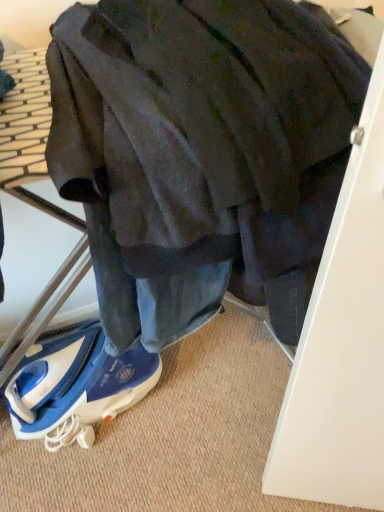
Question: Is blue fabric shoe at lower center positioned beyond the bounds of dark corduroy jacket at center?

Choices:
 (A) yes
 (B) no

Answer: (A)

Question: Is blue fabric shoe at lower center closer to camera compared to dark corduroy jacket at center?

Choices:
 (A) no
 (B) yes

Answer: (A)

Question: Is blue fabric shoe at lower center not close to dark corduroy jacket at center?

Choices:
 (A) no
 (B) yes

Answer: (A)

Question: Is blue fabric shoe at lower center positioned with its back to dark corduroy jacket at center?

Choices:
 (A) yes
 (B) no

Answer: (B)

Question: Is blue fabric shoe at lower center shorter than dark corduroy jacket at center?

Choices:
 (A) no
 (B) yes

Answer: (B)

Question: From the image's perspective, is blue fabric shoe at lower center above dark corduroy jacket at center?

Choices:
 (A) yes
 (B) no

Answer: (B)

Question: Can you confirm if dark corduroy jacket at center is positioned to the left of blue fabric shoe at lower center?

Choices:
 (A) no
 (B) yes

Answer: (A)

Question: Considering the relative sizes of dark corduroy jacket at center and blue fabric shoe at lower center in the image provided, is dark corduroy jacket at center bigger than blue fabric shoe at lower center?

Choices:
 (A) no
 (B) yes

Answer: (B)

Question: Considering the relative sizes of dark corduroy jacket at center and blue fabric shoe at lower center in the image provided, is dark corduroy jacket at center smaller than blue fabric shoe at lower center?

Choices:
 (A) yes
 (B) no

Answer: (B)

Question: Is dark corduroy jacket at center closer to camera compared to blue fabric shoe at lower center?

Choices:
 (A) no
 (B) yes

Answer: (B)

Question: From a real-world perspective, is dark corduroy jacket at center under blue fabric shoe at lower center?

Choices:
 (A) no
 (B) yes

Answer: (A)

Question: Could you tell me if dark corduroy jacket at center is facing blue fabric shoe at lower center?

Choices:
 (A) yes
 (B) no

Answer: (B)

Question: Considering the positions of dark corduroy jacket at center and blue fabric shoe at lower center in the image, is dark corduroy jacket at center taller or shorter than blue fabric shoe at lower center?

Choices:
 (A) tall
 (B) short

Answer: (A)